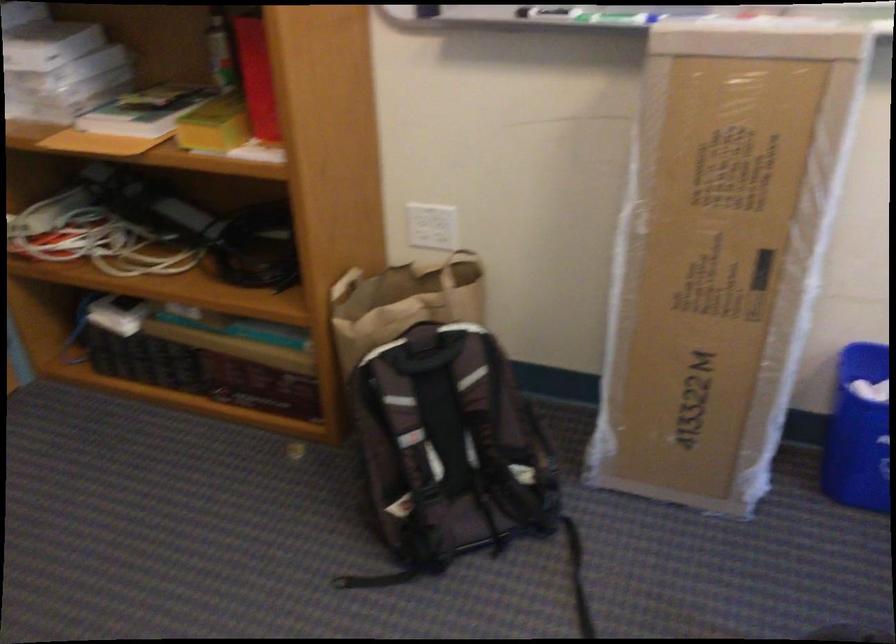
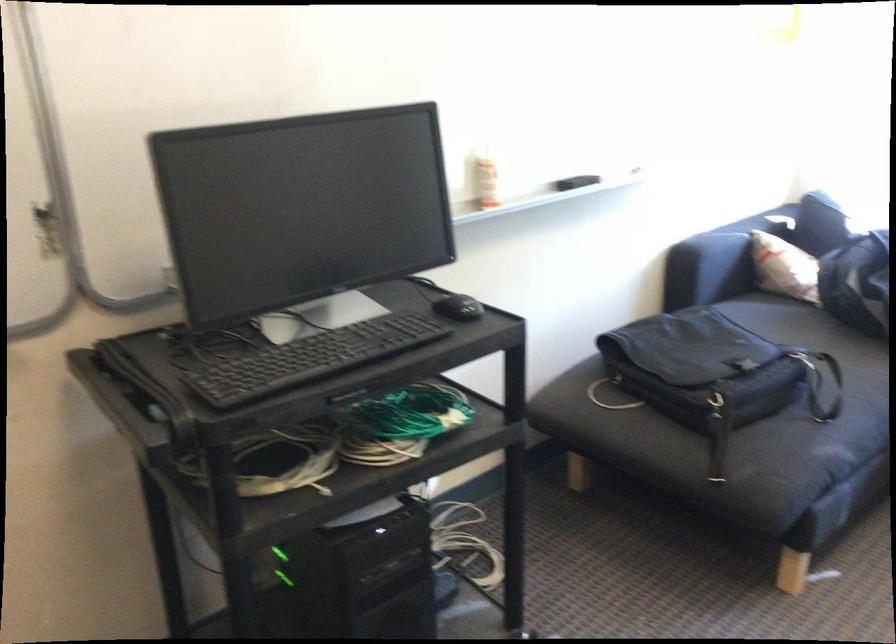
Question: Based on the continuous images, in which direction is the camera rotating? Reply with the corresponding letter.

Choices:
 (A) Left
 (B) Right
 (C) Up
 (D) Down

Answer: (B)